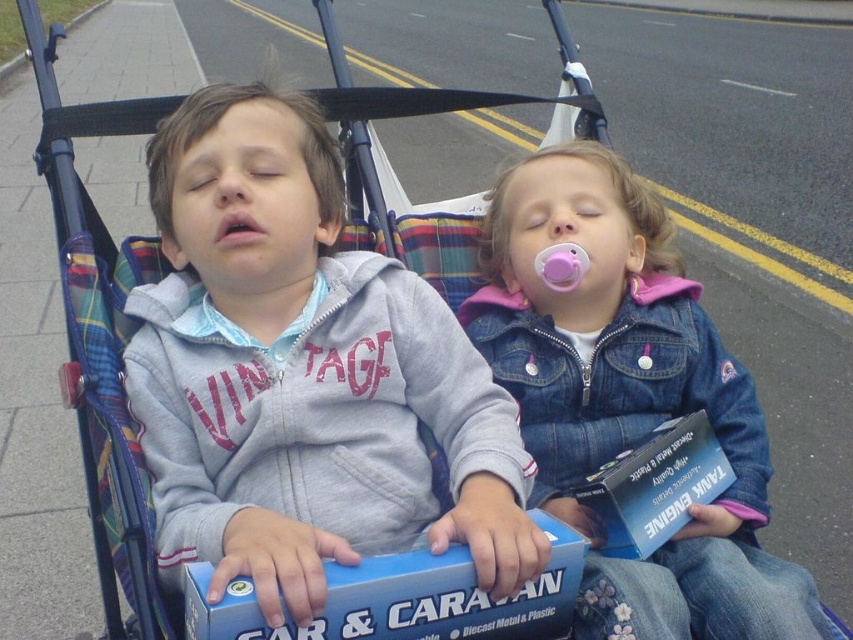
Question: Can you confirm if matte gray hoodie at center is bigger than blue diecast metal & plastic car at center?

Choices:
 (A) yes
 (B) no

Answer: (A)

Question: Among these points, which one is nearest to the camera?

Choices:
 (A) (564, 483)
 (B) (635, 477)
 (C) (252, 506)

Answer: (C)

Question: Does denim jacket at center have a greater width compared to blue diecast metal & plastic car at center?

Choices:
 (A) no
 (B) yes

Answer: (B)

Question: Which of these objects is positioned farthest from the blue diecast metal & plastic car at center?

Choices:
 (A) matte gray hoodie at center
 (B) blue diecast metal & plastic tank engine at center
 (C) denim jacket at center

Answer: (C)

Question: Estimate the real-world distances between objects in this image. Which object is closer to the denim jacket at center?

Choices:
 (A) blue diecast metal & plastic tank engine at center
 (B) matte gray hoodie at center

Answer: (A)

Question: Can you confirm if denim jacket at center is wider than blue diecast metal & plastic car at center?

Choices:
 (A) no
 (B) yes

Answer: (B)